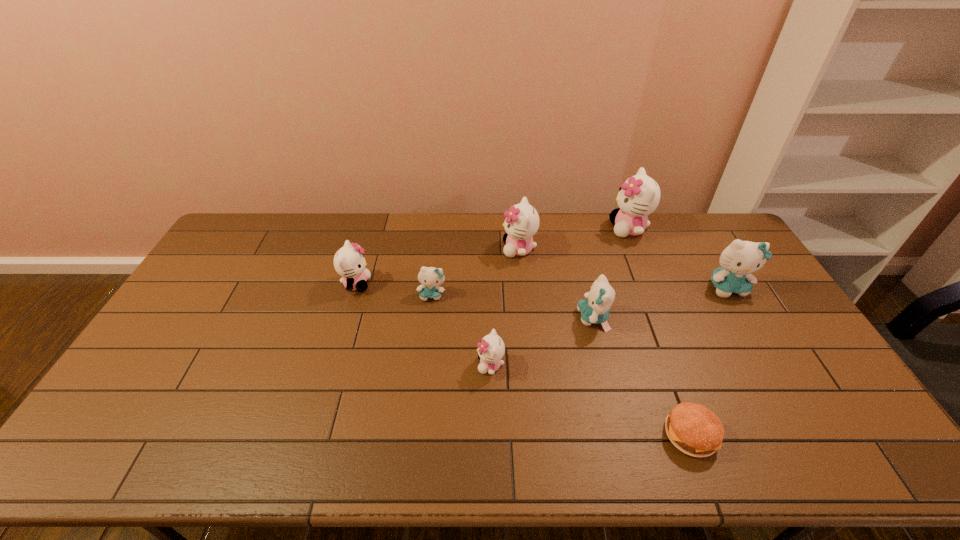
Where is `the second white kitten from left to right`? This screenshot has width=960, height=540. the second white kitten from left to right is located at coordinates (491, 349).

Where is `the smallest white kitten`? This screenshot has height=540, width=960. the smallest white kitten is located at coordinates (491, 349).

Image resolution: width=960 pixels, height=540 pixels. What are the coordinates of `the second object from left to right` in the screenshot? It's located at (430, 277).

At what (x,y) coordinates should I click in order to perform the action: click on the leftmost blue kitten. Please return your answer as a coordinate pair (x, y). The height and width of the screenshot is (540, 960). Looking at the image, I should click on (430, 277).

Find the location of a particular element. This screenshot has width=960, height=540. the nearest object is located at coordinates (694, 429).

What are the coordinates of `the shortest object` in the screenshot? It's located at [694, 429].

You are a GUI agent. You are given a task and a screenshot of the screen. Output one action in this format:
    pyautogui.click(x=<x>, y=<y>)
    Task: Click on the free location located on the front-facing side of the sixth kitten from left to right
    This screenshot has height=540, width=960.
    Given the screenshot: What is the action you would take?
    pyautogui.click(x=544, y=228)

I want to click on vacant space situated on the front-facing side of the sixth kitten from left to right, so click(x=567, y=228).

This screenshot has width=960, height=540. In order to click on free space located on the front-facing side of the sixth kitten from left to right in this screenshot , I will do `click(514, 228)`.

Where is `vacant position located on the front-facing side of the second white kitten from right to left`? The height and width of the screenshot is (540, 960). vacant position located on the front-facing side of the second white kitten from right to left is located at coordinates (458, 249).